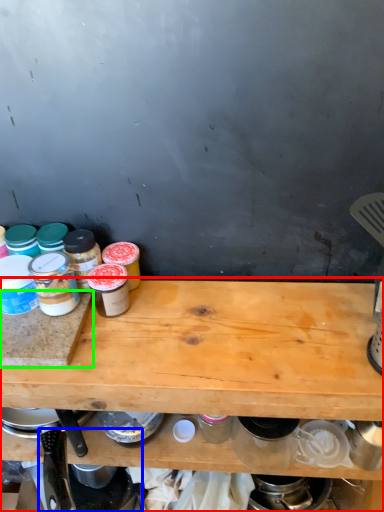
Question: Estimate the real-world distances between objects in this image. Which object is farther from table (highlighted by a red box), appliance (highlighted by a blue box) or cutting board (highlighted by a green box)?

Choices:
 (A) appliance
 (B) cutting board

Answer: (A)